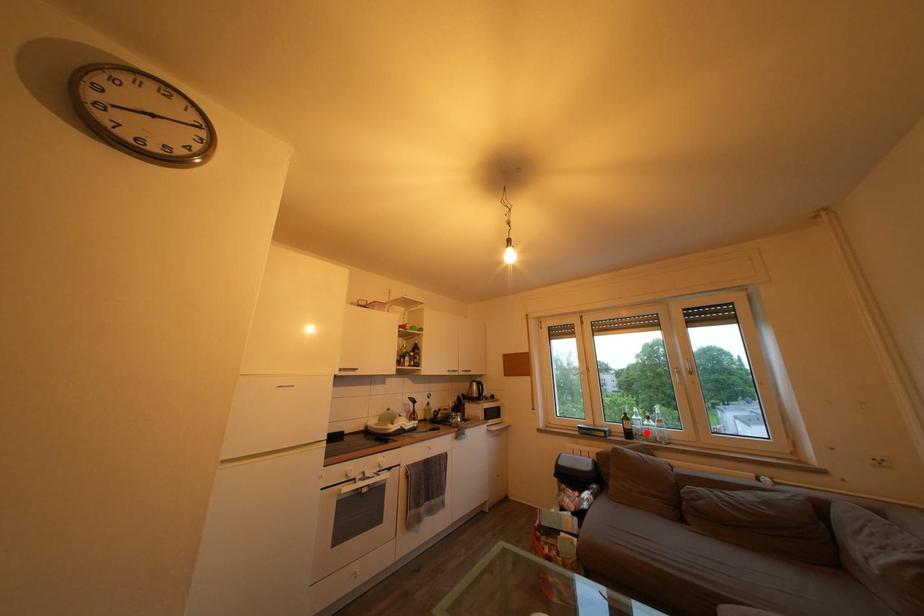
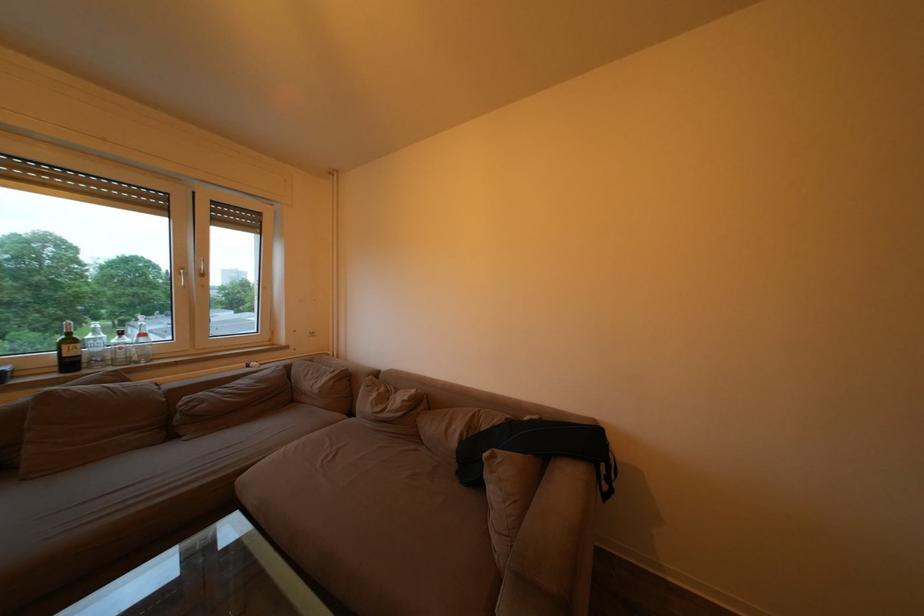
The point at the highlighted location is marked in the first image. Where is the corresponding point in the second image?

(107, 355)